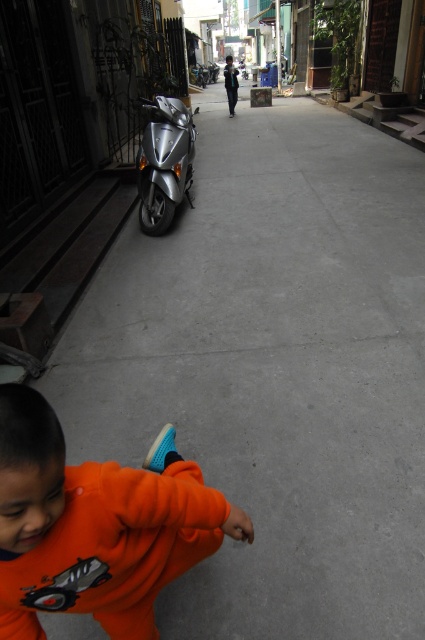
Question: Is orange fleece at lower left above silver metallic motorcycle at center?

Choices:
 (A) yes
 (B) no

Answer: (B)

Question: Which point is closer to the camera?

Choices:
 (A) orange fleece at lower left
 (B) silver metallic motorcycle at center

Answer: (A)

Question: Can you confirm if orange fleece at lower left is thinner than silver metallic motorcycle at center?

Choices:
 (A) yes
 (B) no

Answer: (A)

Question: Which point is farther from the camera taking this photo?

Choices:
 (A) (53, 588)
 (B) (192, 152)

Answer: (B)

Question: Does orange fleece at lower left have a greater width compared to silver metallic motorcycle at center?

Choices:
 (A) no
 (B) yes

Answer: (A)